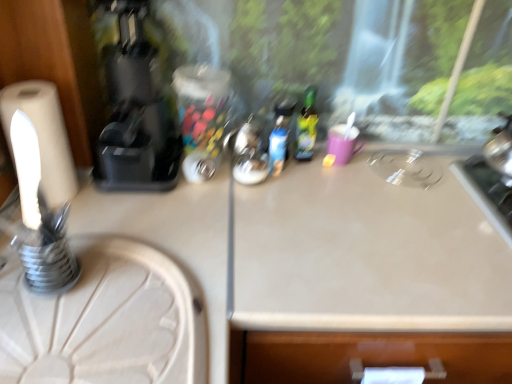
Question: From a real-world perspective, does matte plastic bottle at center, which is the 2th bottle from right to left, stand above white wood round table at lower left?

Choices:
 (A) yes
 (B) no

Answer: (A)

Question: From the image's perspective, is matte plastic bottle at center, which is the 2th bottle from right to left, below white wood round table at lower left?

Choices:
 (A) yes
 (B) no

Answer: (B)

Question: Can you confirm if matte plastic bottle at center, which is the 1th bottle from left to right, is wider than white wood round table at lower left?

Choices:
 (A) no
 (B) yes

Answer: (A)

Question: Is matte plastic bottle at center, which is the 1th bottle from left to right, positioned behind white wood round table at lower left?

Choices:
 (A) no
 (B) yes

Answer: (B)

Question: Is matte plastic bottle at center, which is the 1th bottle from left to right, surrounding white wood round table at lower left?

Choices:
 (A) yes
 (B) no

Answer: (B)

Question: From the image's perspective, is matte plastic bottle at center, which is the 2th bottle from right to left, on white wood round table at lower left?

Choices:
 (A) yes
 (B) no

Answer: (A)

Question: From the image's perspective, does white matte toilet paper at left appear lower than green glass bottle at center, the second bottle positioned from the left?

Choices:
 (A) yes
 (B) no

Answer: (A)

Question: From the image's perspective, is white matte toilet paper at left on green glass bottle at center, the second bottle positioned from the left?

Choices:
 (A) yes
 (B) no

Answer: (B)

Question: Could you tell me if white matte toilet paper at left is facing green glass bottle at center, which is counted as the first bottle, starting from the right?

Choices:
 (A) yes
 (B) no

Answer: (B)

Question: Can you confirm if white matte toilet paper at left is shorter than green glass bottle at center, which is counted as the first bottle, starting from the right?

Choices:
 (A) yes
 (B) no

Answer: (B)

Question: From a real-world perspective, is white matte toilet paper at left on top of green glass bottle at center, the second bottle positioned from the left?

Choices:
 (A) no
 (B) yes

Answer: (B)

Question: Is white matte toilet paper at left facing away from green glass bottle at center, which is counted as the first bottle, starting from the right?

Choices:
 (A) yes
 (B) no

Answer: (B)

Question: Can white matte toilet paper at left be found inside black plastic coffee machine at left?

Choices:
 (A) no
 (B) yes

Answer: (A)